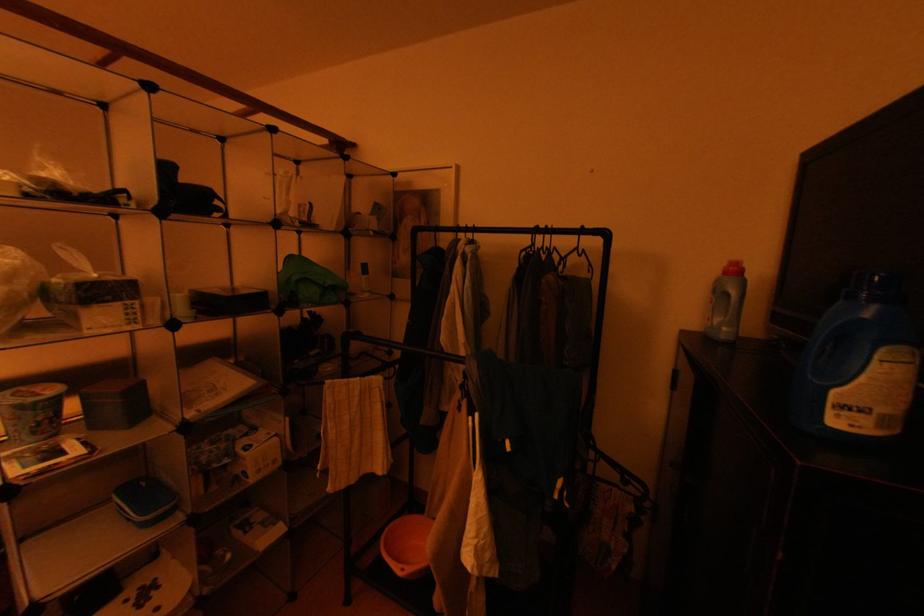
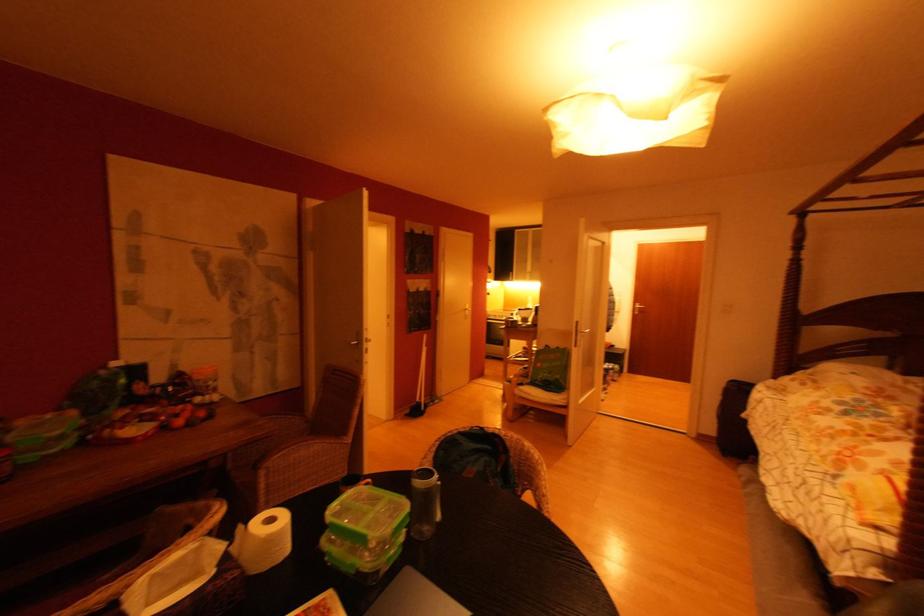
Question: The camera is either moving clockwise (left) or counter-clockwise (right) around the object. The first image is from the beginning of the video and the second image is from the end. Is the camera moving left or right when shooting the video?

Choices:
 (A) Left
 (B) Right

Answer: (B)